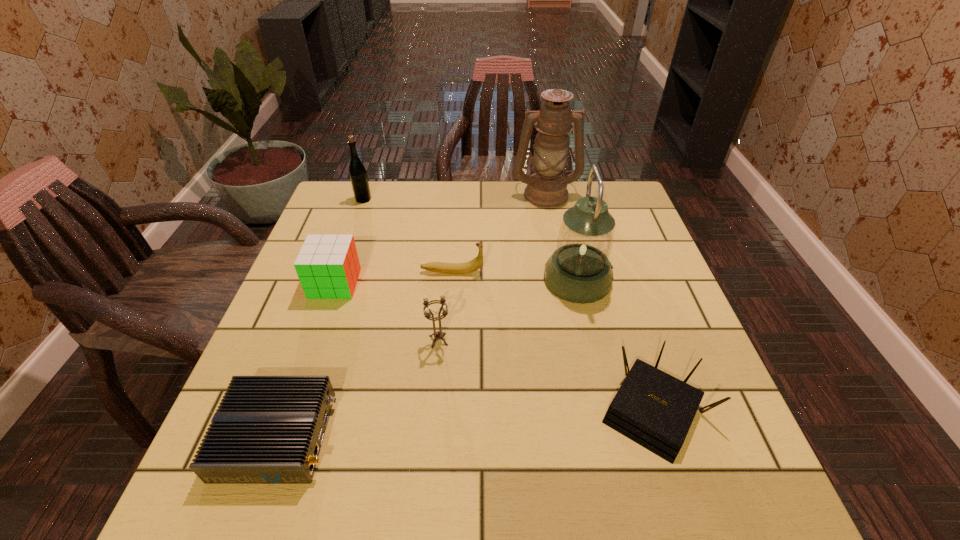
I want to click on oil lamp, so click(546, 188).

The width and height of the screenshot is (960, 540). What are the coordinates of `lantern` in the screenshot? It's located at (579, 271).

This screenshot has width=960, height=540. Find the location of `beer bottle`. beer bottle is located at coordinates (358, 175).

Where is `candle holder`? candle holder is located at coordinates (437, 335).

What are the coordinates of `cube` in the screenshot? It's located at (328, 267).

Where is `banana`? The height and width of the screenshot is (540, 960). banana is located at coordinates (451, 268).

At what (x,y) coordinates should I click in order to perform the action: click on the taller router. Please return your answer as a coordinate pair (x, y). The image size is (960, 540). Looking at the image, I should click on (652, 408).

You are a GUI agent. You are given a task and a screenshot of the screen. Output one action in this format:
    pyautogui.click(x=<x>, y=<y>)
    Task: Click on the left router
    Image resolution: width=960 pixels, height=540 pixels.
    Given the screenshot: What is the action you would take?
    pyautogui.click(x=267, y=429)

Locate an element on the screen. Image resolution: width=960 pixels, height=540 pixels. the shorter router is located at coordinates (267, 429).

You are a GUI agent. You are given a task and a screenshot of the screen. Output one action in this format:
    pyautogui.click(x=<x>, y=<y>)
    Task: Click on the vacant space located 0.230m on the front of the oil lamp
    This screenshot has width=960, height=540.
    Given the screenshot: What is the action you would take?
    pyautogui.click(x=558, y=255)